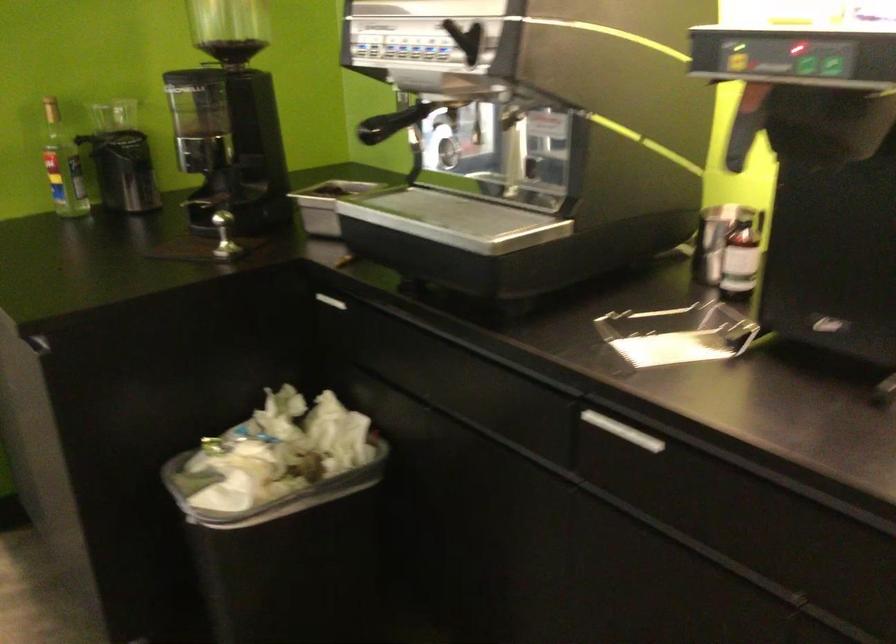
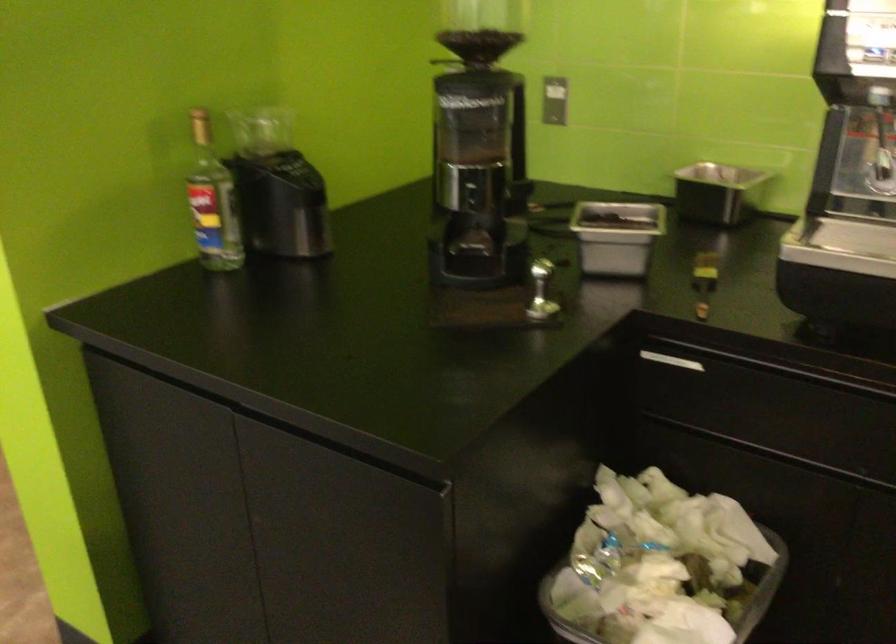
In a continuous first-person perspective shot, in which direction is the camera moving?

The movement direction of the cameraman is left, forward.